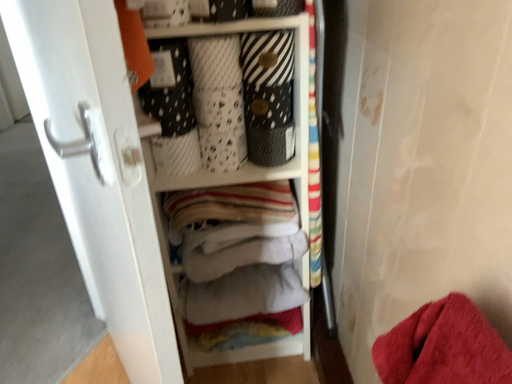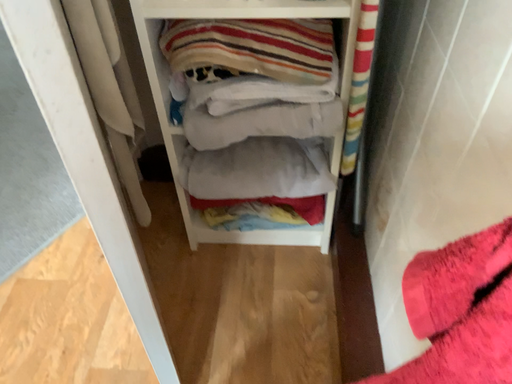
Question: How did the camera likely rotate when shooting the video?

Choices:
 (A) rotated downward
 (B) rotated upward

Answer: (A)